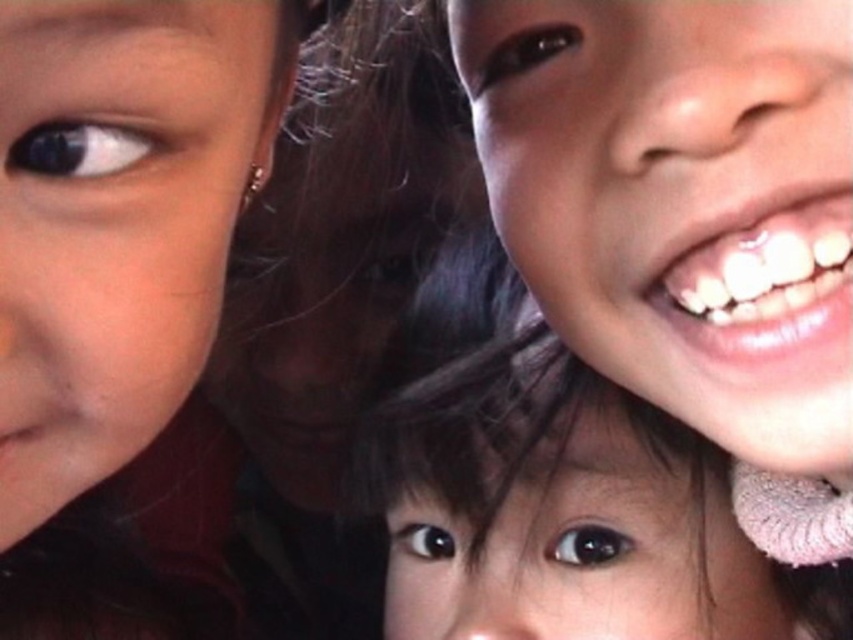
Between smooth skin face at right and matte skin at left, which one has more height?

smooth skin face at right is taller.

The height and width of the screenshot is (640, 853). I want to click on smooth skin face at right, so click(682, 202).

I want to click on smooth skin face at right, so click(x=682, y=202).

How much distance is there between matte skin at left and white glossy teeth at upper right?

matte skin at left is 7.23 inches from white glossy teeth at upper right.

Is matte skin at left positioned in front of white glossy teeth at upper right?

Yes.

Where is `matte skin at left`? This screenshot has width=853, height=640. matte skin at left is located at coordinates (115, 221).

In the scene shown: Does smooth skin face at right have a greater height compared to smooth skin child at center?

Incorrect, smooth skin face at right's height is not larger of smooth skin child at center's.

Is smooth skin face at right behind smooth skin child at center?

No, it is in front of smooth skin child at center.

Locate an element on the screen. The image size is (853, 640). smooth skin face at right is located at coordinates (682, 202).